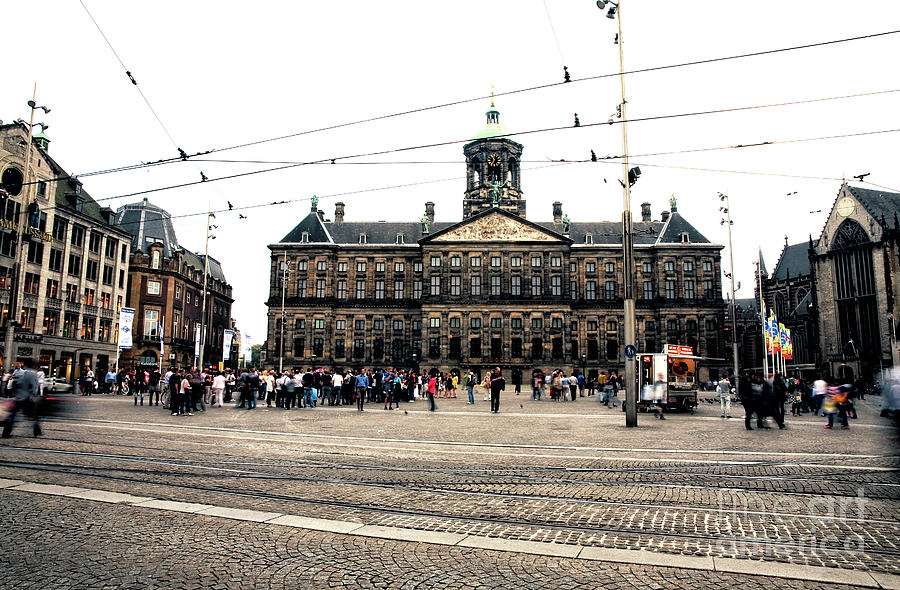
Find the location of a particular element. clock is located at coordinates (493, 157).